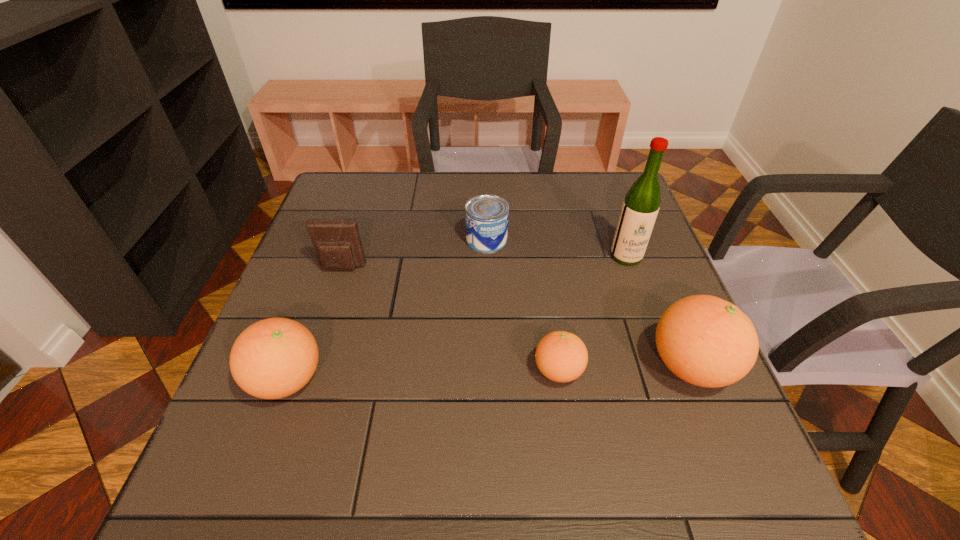
To achieve even spacing by inserting another orange_(fruit) among them, please point to a vacant spot for this new orange_(fruit). Please provide its 2D coordinates. Your answer should be formatted as a tuple, i.e. [(x, y)], where the tuple contains the x and y coordinates of a point satisfying the conditions above.

[(424, 375)]